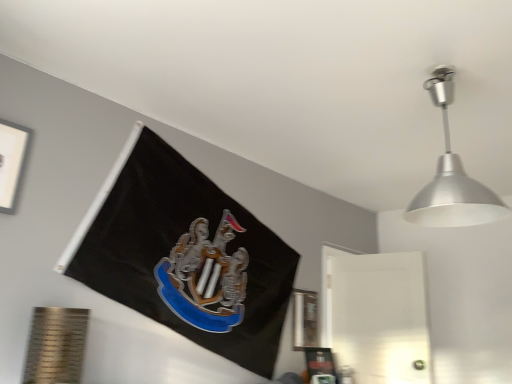
Question: Is silver metallic lampshade at upper right positioned before white matte picture frame at upper left, the first picture frame when ordered from front to back?

Choices:
 (A) no
 (B) yes

Answer: (B)

Question: Is silver metallic lampshade at upper right surrounding white matte picture frame at upper left, the second picture frame positioned from the bottom?

Choices:
 (A) no
 (B) yes

Answer: (A)

Question: Is silver metallic lampshade at upper right turned away from white matte picture frame at upper left, the first picture frame when ordered from front to back?

Choices:
 (A) no
 (B) yes

Answer: (A)

Question: Considering the relative sizes of silver metallic lampshade at upper right and white matte picture frame at upper left, the second picture frame when ordered from back to front, in the image provided, is silver metallic lampshade at upper right thinner than white matte picture frame at upper left, the second picture frame when ordered from back to front,?

Choices:
 (A) no
 (B) yes

Answer: (A)

Question: From a real-world perspective, is silver metallic lampshade at upper right on white matte picture frame at upper left, the second picture frame positioned from the bottom?

Choices:
 (A) yes
 (B) no

Answer: (A)

Question: Is silver metallic lampshade at upper right not near white matte picture frame at upper left, the first picture frame when ordered from front to back?

Choices:
 (A) yes
 (B) no

Answer: (A)

Question: Is white matte picture frame at upper left, the second picture frame when ordered from back to front, taller than metallic silver picture frame at lower right, which is counted as the 1th picture frame, starting from the back?

Choices:
 (A) yes
 (B) no

Answer: (B)

Question: Is white matte picture frame at upper left, the first picture frame when ordered from front to back, thinner than metallic silver picture frame at lower right, arranged as the second picture frame when viewed from the left?

Choices:
 (A) no
 (B) yes

Answer: (A)

Question: Is white matte picture frame at upper left, the second picture frame when ordered from back to front, not near metallic silver picture frame at lower right, which appears as the 1th picture frame when ordered from the bottom?

Choices:
 (A) yes
 (B) no

Answer: (A)

Question: Is white matte picture frame at upper left, the first picture frame when ordered from front to back, further to the viewer compared to metallic silver picture frame at lower right, which appears as the 1th picture frame when ordered from the bottom?

Choices:
 (A) yes
 (B) no

Answer: (B)

Question: Is white matte picture frame at upper left, the second picture frame positioned from the bottom, at the left side of metallic silver picture frame at lower right, which ranks as the 2th picture frame in front-to-back order?

Choices:
 (A) no
 (B) yes

Answer: (B)

Question: Does white matte picture frame at upper left, the first picture frame when ordered from front to back, have a lesser height compared to metallic silver picture frame at lower right, arranged as the second picture frame when viewed from the left?

Choices:
 (A) yes
 (B) no

Answer: (A)

Question: Is metallic silver picture frame at lower right, which ranks as the second picture frame in top-to-bottom order, wider than white matte picture frame at upper left, the second picture frame when ordered from back to front?

Choices:
 (A) yes
 (B) no

Answer: (B)